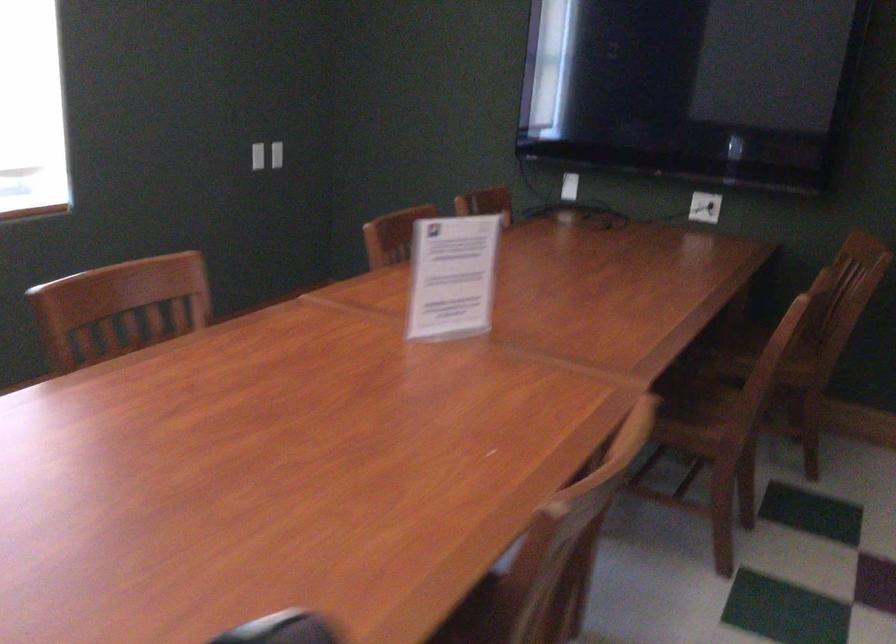
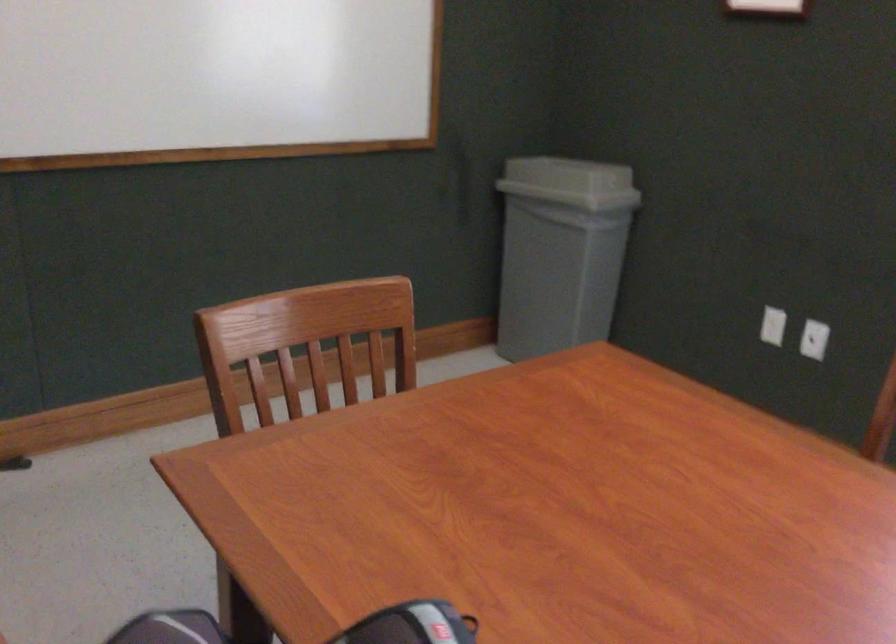
First-person continuous shooting, in which direction is the camera rotating?

The rotation direction of the camera is left-down.